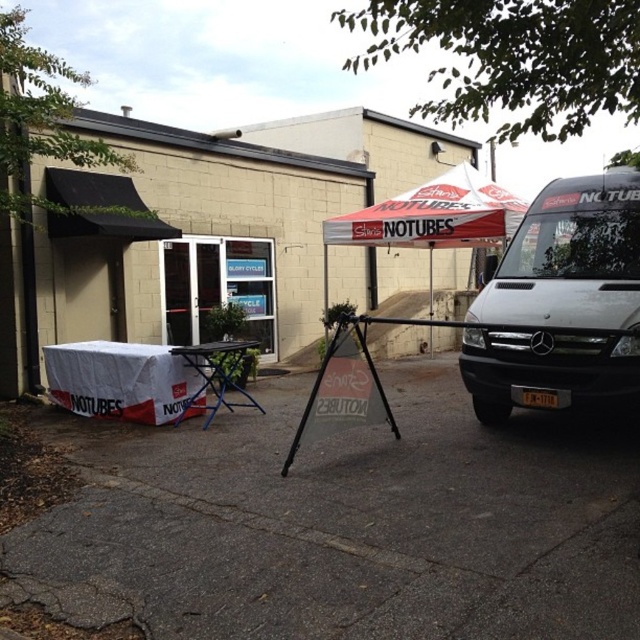
Between white glossy van at right and white/red fabric canopy at center, which one appears on the left side from the viewer's perspective?

From the viewer's perspective, white/red fabric canopy at center appears more on the left side.

Does white glossy van at right appear on the left side of white/red fabric canopy at center?

In fact, white glossy van at right is to the right of white/red fabric canopy at center.

Which is behind, point (497, 285) or point (400, 198)?

The point (400, 198) is behind.

Where is `white glossy van at right`? The image size is (640, 640). white glossy van at right is located at coordinates (570, 257).